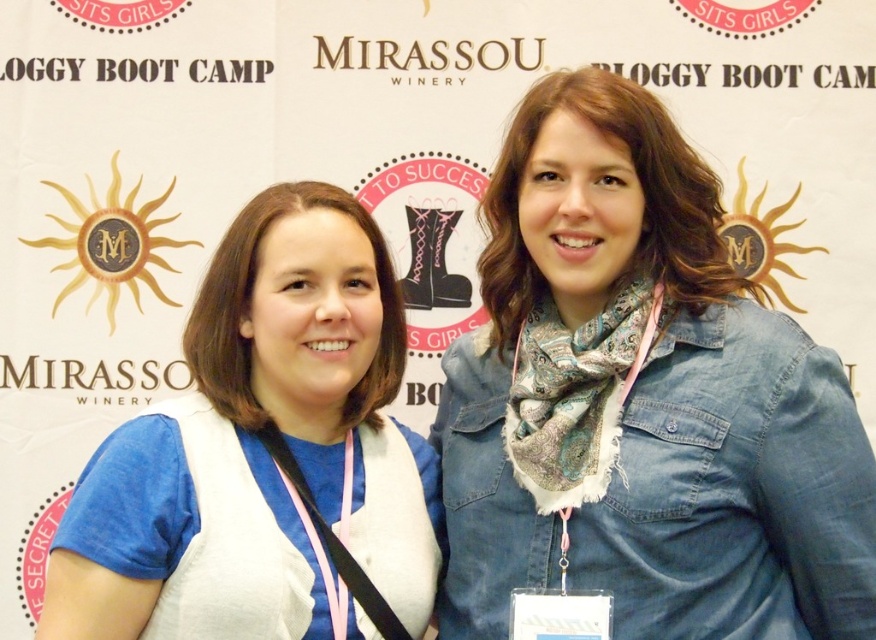
Question: Is white matte vest at center thinner than pink fabric lanyard at left?

Choices:
 (A) yes
 (B) no

Answer: (B)

Question: Which of the following is the closest to the observer?

Choices:
 (A) (634, 234)
 (B) (576, 472)

Answer: (B)

Question: Which object appears farthest from the camera in this image?

Choices:
 (A) pink fabric lanyard at center
 (B) pink fabric lanyard at left

Answer: (B)

Question: Which object is farther from the camera taking this photo?

Choices:
 (A) white matte vest at center
 (B) denim jacket at upper right
 (C) pink fabric lanyard at center

Answer: (C)

Question: Does white matte vest at center come in front of pink fabric lanyard at center?

Choices:
 (A) no
 (B) yes

Answer: (B)

Question: Can you confirm if pink fabric lanyard at center is positioned above pink fabric lanyard at left?

Choices:
 (A) yes
 (B) no

Answer: (A)